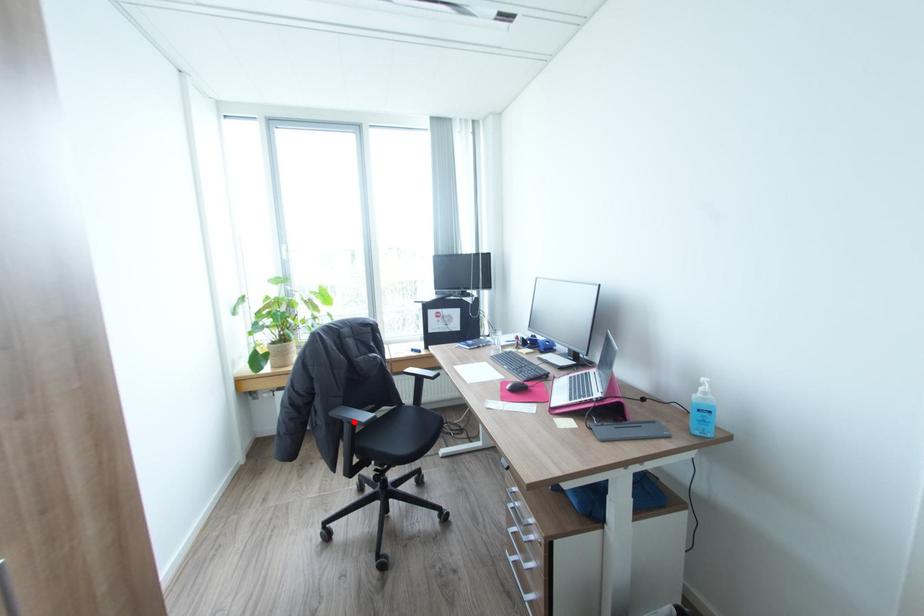
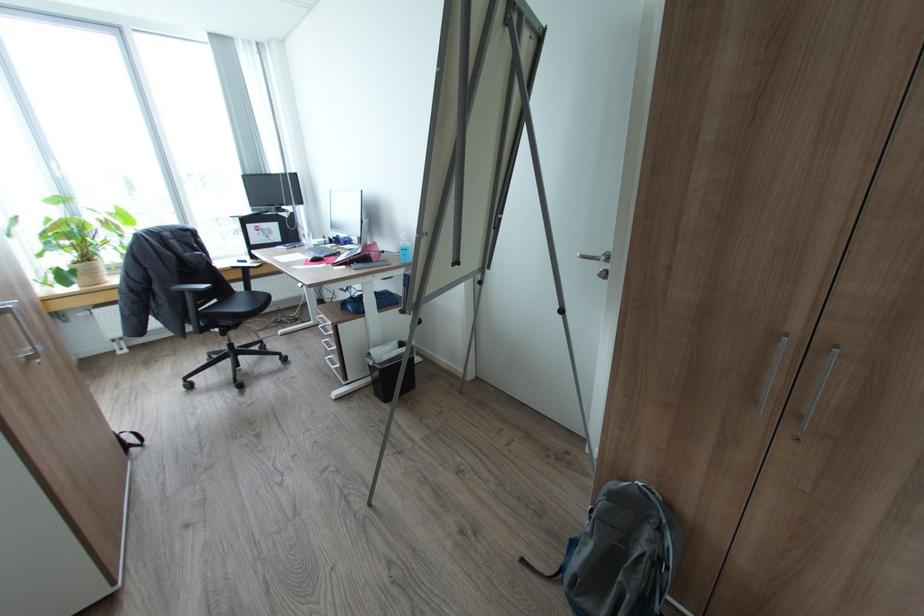
The point at the highlighted location is marked in the first image. Where is the corresponding point in the second image?

(195, 292)